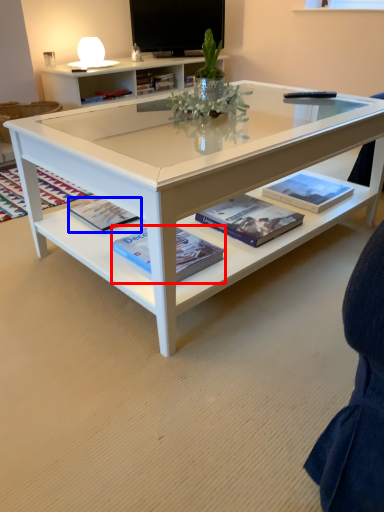
Question: Among these objects, which one is farthest to the camera, book (highlighted by a red box) or paperback book (highlighted by a blue box)?

Choices:
 (A) book
 (B) paperback book

Answer: (B)